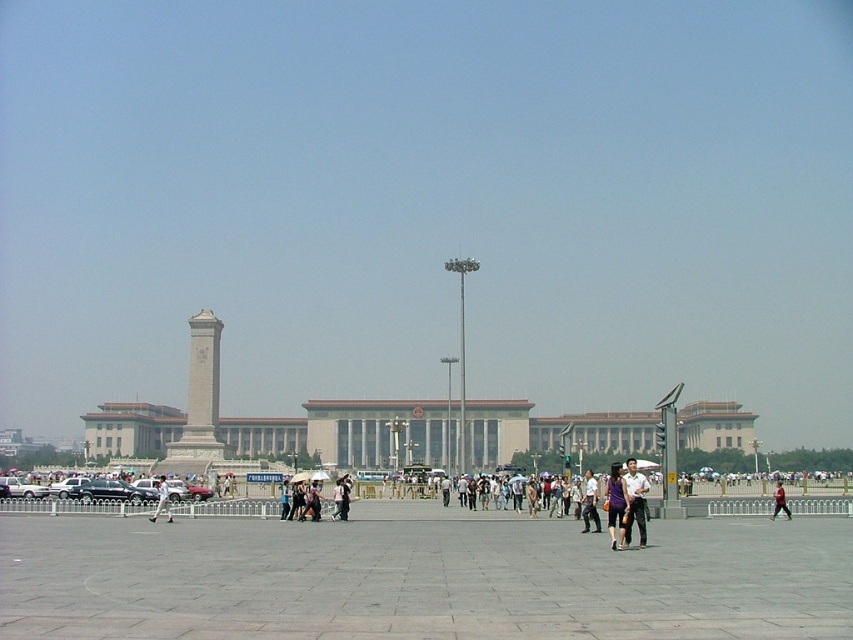
Question: Can you confirm if white marble monument at center is positioned to the right of purple matte dress at center?

Choices:
 (A) no
 (B) yes

Answer: (A)

Question: Does purple matte dress at center have a larger size compared to white cotton shirt at center?

Choices:
 (A) yes
 (B) no

Answer: (A)

Question: Which of the following is the closest to the observer?

Choices:
 (A) (161, 483)
 (B) (189, 408)
 (C) (590, 474)

Answer: (C)

Question: Among these objects, which one is nearest to the camera?

Choices:
 (A) white marble monument at center
 (B) purple matte dress at center
 (C) dark purple shirt at center

Answer: (B)

Question: Which point is farther to the camera?

Choices:
 (A) white shirt at center
 (B) white marble monument at center

Answer: (B)

Question: Can you confirm if white shirt at center is positioned below red fabric person at center?

Choices:
 (A) no
 (B) yes

Answer: (B)